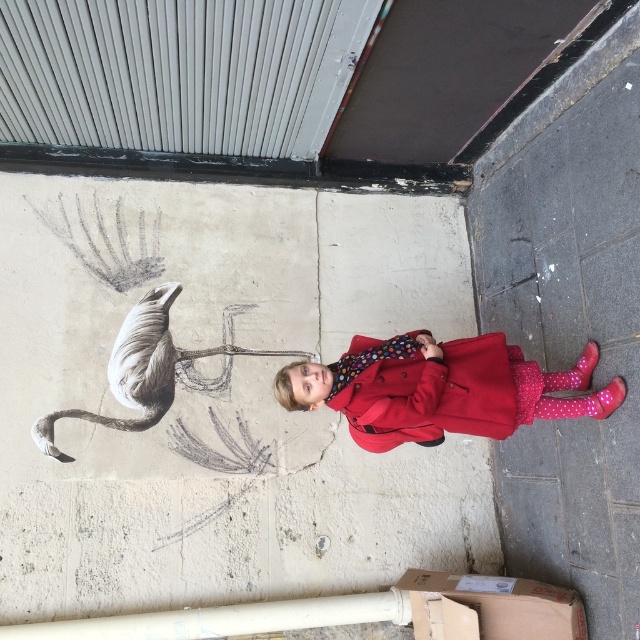
Question: From the image, what is the correct spatial relationship of smooth concrete wall at center in relation to matte red coat at center?

Choices:
 (A) right
 (B) left

Answer: (B)

Question: Which object appears closest to the camera in this image?

Choices:
 (A) matte red coat at center
 (B) gray concrete sidewalk at lower right
 (C) smooth concrete wall at center

Answer: (B)

Question: Which of the following is the closest to the observer?

Choices:
 (A) matte red coat at center
 (B) smooth concrete wall at center

Answer: (A)

Question: Is gray concrete sidewalk at lower right smaller than matte red coat at center?

Choices:
 (A) yes
 (B) no

Answer: (B)

Question: Which object appears farthest from the camera in this image?

Choices:
 (A) matte red coat at center
 (B) smooth concrete wall at center

Answer: (B)

Question: Can you confirm if smooth concrete wall at center is positioned below gray concrete sidewalk at lower right?

Choices:
 (A) no
 (B) yes

Answer: (B)